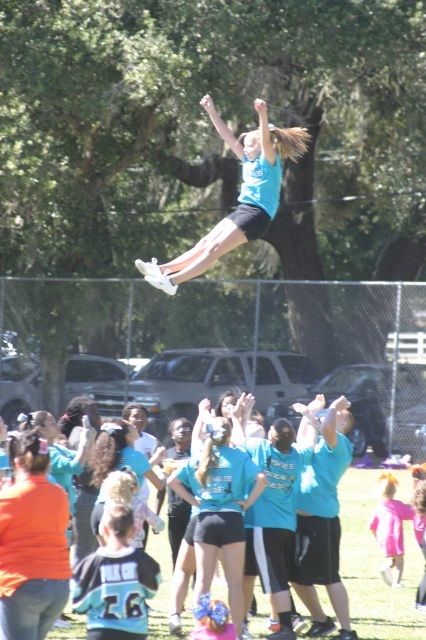
Question: From the image, what is the correct spatial relationship of matte blue shirt at center in relation to pink satin dress at lower right?

Choices:
 (A) left
 (B) right

Answer: (A)

Question: Can you confirm if matte blue shirt at center is bigger than matte blue tank top at center?

Choices:
 (A) no
 (B) yes

Answer: (A)

Question: Which of the following is the farthest from the observer?

Choices:
 (A) matte blue shirt at center
 (B) matte blue tank top at center
 (C) pink satin dress at lower right

Answer: (C)

Question: Which object is the farthest from the matte blue tank top at center?

Choices:
 (A) pink satin dress at lower right
 (B) matte blue shirt at center

Answer: (A)

Question: Based on their relative distances, which object is nearer to the pink satin dress at lower right?

Choices:
 (A) matte blue tank top at center
 (B) matte blue shirt at center

Answer: (B)

Question: Can you confirm if matte blue shirt at center is bigger than pink satin dress at lower right?

Choices:
 (A) yes
 (B) no

Answer: (A)